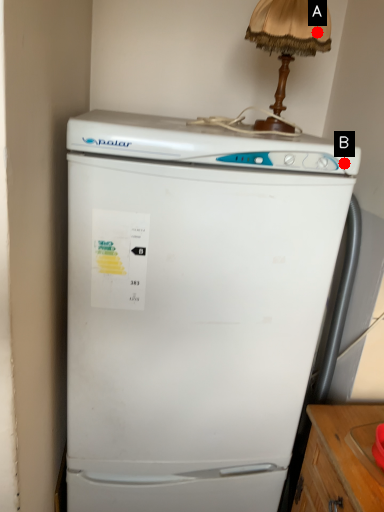
Question: Two points are circled on the image, labeled by A and B beside each circle. Which point is farther from the camera taking this photo?

Choices:
 (A) A is further
 (B) B is further

Answer: (A)